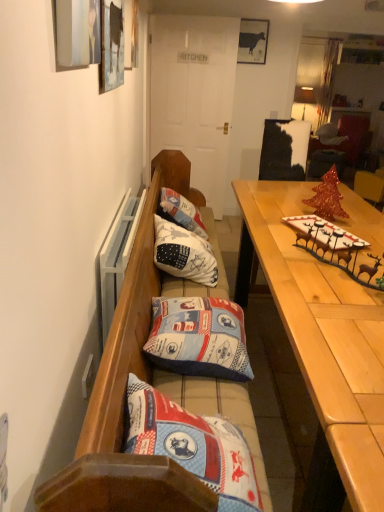
What do you see at coordinates (184, 253) in the screenshot? The image size is (384, 512). I see `white cotton cushion at center, which is the first pillow in top-to-bottom order` at bounding box center [184, 253].

I want to click on matte black cabinet at upper right, so click(352, 132).

This screenshot has height=512, width=384. Identify the location of matte black cow at upper center. (253, 41).

This screenshot has height=512, width=384. I want to click on blue fabric pillow at center, which is counted as the second pillow, starting from the top, so click(x=199, y=338).

Where is `white cotton cushion at center, which is the 2th pillow in bottom-to-top order`? white cotton cushion at center, which is the 2th pillow in bottom-to-top order is located at coordinates (184, 253).

Is the depth of light wood table at right greater than that of matte black cabinet at upper right?

No, light wood table at right is closer to the camera.

Based on the photo, is light wood table at right oriented towards matte black cabinet at upper right?

No, light wood table at right is not turned towards matte black cabinet at upper right.

In terms of size, does light wood table at right appear bigger or smaller than matte black cabinet at upper right?

Considering their sizes, light wood table at right takes up more space than matte black cabinet at upper right.

Looking at their sizes, would you say light wood table at right is wider or thinner than matte black cabinet at upper right?

Clearly, light wood table at right has more width compared to matte black cabinet at upper right.

Is white cotton cushion at center, the first pillow from the back, located within matte black cabinet at upper right?

No, white cotton cushion at center, the first pillow from the back, is not inside matte black cabinet at upper right.

Does matte black cabinet at upper right touch white cotton cushion at center, which appears as the 2th pillow when viewed from the front?

matte black cabinet at upper right and white cotton cushion at center, which appears as the 2th pillow when viewed from the front, are not in contact.

This screenshot has height=512, width=384. In order to click on pillow that is the 1st object located in front of the matte black cabinet at upper right in this screenshot , I will do `click(184, 253)`.

Which is in front, matte black cabinet at upper right or white cotton cushion at center, which is the first pillow in top-to-bottom order?

white cotton cushion at center, which is the first pillow in top-to-bottom order, is in front.

Are white cotton cushion at center, which is the 2th pillow in bottom-to-top order, and light wood table at right making contact?

white cotton cushion at center, which is the 2th pillow in bottom-to-top order, is not next to light wood table at right, and they're not touching.

Is white cotton cushion at center, which is the 2th pillow in bottom-to-top order, further to the viewer compared to light wood table at right?

That is True.

Considering the sizes of white cotton cushion at center, which is the 2th pillow in bottom-to-top order, and light wood table at right in the image, is white cotton cushion at center, which is the 2th pillow in bottom-to-top order, wider or thinner than light wood table at right?

Clearly, white cotton cushion at center, which is the 2th pillow in bottom-to-top order, has less width compared to light wood table at right.

From the image's perspective, which object appears higher, white cotton cushion at center, which is the first pillow in top-to-bottom order, or light wood table at right?

white cotton cushion at center, which is the first pillow in top-to-bottom order, from the image's perspective.

Looking at this image, between matte black cow at upper center and wooden bench with cushions at center, which one has larger size?

wooden bench with cushions at center is bigger.

How far apart are matte black cow at upper center and wooden bench with cushions at center?

A distance of 9.26 feet exists between matte black cow at upper center and wooden bench with cushions at center.

Is point (255, 44) farther from camera compared to point (179, 165)?

Yes, it is.

From a real-world perspective, who is located higher, light wood table at right or blue fabric pillow at center, which appears as the 1th pillow when ordered from the bottom?

blue fabric pillow at center, which appears as the 1th pillow when ordered from the bottom, is physically above.

Is light wood table at right turned away from blue fabric pillow at center, which appears as the 1th pillow when ordered from the bottom?

Absolutely, light wood table at right is directed away from blue fabric pillow at center, which appears as the 1th pillow when ordered from the bottom.

Is light wood table at right bigger or smaller than blue fabric pillow at center, positioned as the 2th pillow in back-to-front order?

Considering their sizes, light wood table at right takes up more space than blue fabric pillow at center, positioned as the 2th pillow in back-to-front order.

Which point is more forward, [257,245] or [205,337]?

The point [205,337] is more forward.

Is wooden bench with cushions at center completely or partially inside matte black cabinet at upper right?

No, wooden bench with cushions at center is not a part of matte black cabinet at upper right.

The image size is (384, 512). I want to click on cabinetry above the wooden bench with cushions at center (from the image's perspective), so click(x=352, y=132).

How distant is matte black cabinet at upper right from wooden bench with cushions at center?

matte black cabinet at upper right and wooden bench with cushions at center are 11.95 feet apart.

Is matte black cabinet at upper right oriented away from wooden bench with cushions at center?

No, matte black cabinet at upper right's orientation is not away from wooden bench with cushions at center.

Between white cotton cushion at center, the first pillow from the back, and blue fabric pillow at center, which is counted as the second pillow, starting from the top, which one has larger width?

With larger width is blue fabric pillow at center, which is counted as the second pillow, starting from the top.

Between white cotton cushion at center, which is the first pillow in top-to-bottom order, and blue fabric pillow at center, which is counted as the second pillow, starting from the top, which one has more height?

Standing taller between the two is white cotton cushion at center, which is the first pillow in top-to-bottom order.

Is white cotton cushion at center, which appears as the 2th pillow when viewed from the front, in front of or behind blue fabric pillow at center, the 1th pillow from the front, in the image?

Clearly, white cotton cushion at center, which appears as the 2th pillow when viewed from the front, is behind blue fabric pillow at center, the 1th pillow from the front.

In terms of size, does white cotton cushion at center, which is the 2th pillow in bottom-to-top order, appear bigger or smaller than blue fabric pillow at center, which appears as the 1th pillow when ordered from the bottom?

white cotton cushion at center, which is the 2th pillow in bottom-to-top order, is bigger than blue fabric pillow at center, which appears as the 1th pillow when ordered from the bottom.

Identify the location of desk on the left of matte black cabinet at upper right. This screenshot has height=512, width=384. (322, 346).

You are a GUI agent. You are given a task and a screenshot of the screen. Output one action in this format:
    pyautogui.click(x=<x>, y=<y>)
    Task: Click on the cabinetry on the right of white cotton cushion at center, which appears as the 2th pillow when viewed from the front
    Image resolution: width=384 pixels, height=512 pixels.
    Given the screenshot: What is the action you would take?
    pyautogui.click(x=352, y=132)

Looking at the image, which one is located further to blue fabric pillow at center, positioned as the 2th pillow in back-to-front order, white cotton cushion at center, which appears as the 2th pillow when viewed from the front, or matte black cabinet at upper right?

The object further to blue fabric pillow at center, positioned as the 2th pillow in back-to-front order, is matte black cabinet at upper right.

Looking at the image, which one is located further to blue fabric pillow at center, the 1th pillow from the front, matte black cow at upper center or white cotton cushion at center, which appears as the 2th pillow when viewed from the front?

matte black cow at upper center is further to blue fabric pillow at center, the 1th pillow from the front.

When comparing their distances from matte black cow at upper center, does light wood table at right or blue fabric pillow at center, which is counted as the second pillow, starting from the top, seem further?

The object further to matte black cow at upper center is blue fabric pillow at center, which is counted as the second pillow, starting from the top.

From the image, which object appears to be nearer to light wood table at right, white cotton cushion at center, which is the first pillow in top-to-bottom order, or matte black cow at upper center?

Among the two, white cotton cushion at center, which is the first pillow in top-to-bottom order, is located nearer to light wood table at right.

Which object lies nearer to the anchor point matte black cow at upper center, light wood table at right or matte black cabinet at upper right?

The object closer to matte black cow at upper center is matte black cabinet at upper right.

In the scene shown: From the image, which object appears to be farther from wooden bench with cushions at center, matte black cabinet at upper right or blue fabric pillow at center, which is counted as the second pillow, starting from the top?

The object further to wooden bench with cushions at center is matte black cabinet at upper right.

When comparing their distances from light wood table at right, does blue fabric pillow at center, which is counted as the second pillow, starting from the top, or matte black cabinet at upper right seem further?

→ matte black cabinet at upper right is positioned further to the anchor light wood table at right.

Estimate the real-world distances between objects in this image. Which object is further from matte black cow at upper center, blue fabric pillow at center, which appears as the 1th pillow when ordered from the bottom, or matte black cabinet at upper right?

blue fabric pillow at center, which appears as the 1th pillow when ordered from the bottom, lies further to matte black cow at upper center than the other object.

Locate an element on the screen. This screenshot has width=384, height=512. desk between wooden bench with cushions at center and matte black cow at upper center in the front-back direction is located at coordinates (322, 346).

At what (x,y) coordinates should I click in order to perform the action: click on picture frame positioned between blue fabric pillow at center, which appears as the 1th pillow when ordered from the bottom, and matte black cabinet at upper right from near to far. Please return your answer as a coordinate pair (x, y). The height and width of the screenshot is (512, 384). Looking at the image, I should click on (253, 41).

Identify the location of pillow positioned between blue fabric pillow at center, positioned as the 2th pillow in back-to-front order, and matte black cow at upper center from near to far. (184, 253).

Where is `picture frame between wooden bench with cushions at center and matte black cabinet at upper right along the z-axis`? The width and height of the screenshot is (384, 512). picture frame between wooden bench with cushions at center and matte black cabinet at upper right along the z-axis is located at coordinates (253, 41).